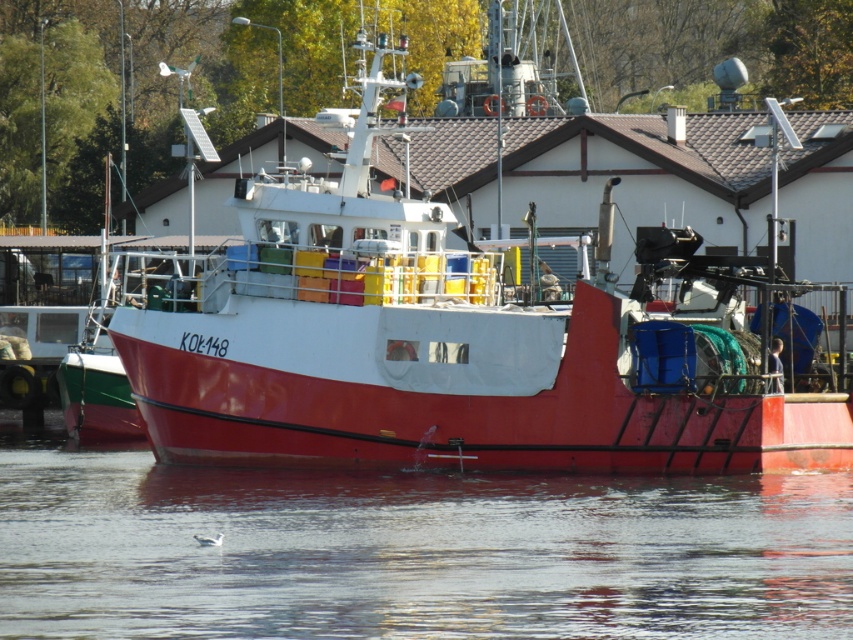
Question: Where is red matte boat at center located in relation to transparent water at lower center in the image?

Choices:
 (A) left
 (B) right

Answer: (B)

Question: In this image, where is red matte boat at center located relative to transparent water at lower center?

Choices:
 (A) above
 (B) below

Answer: (A)

Question: Is red matte boat at center in front of transparent water at lower center?

Choices:
 (A) yes
 (B) no

Answer: (B)

Question: Among these points, which one is farthest from the camera?

Choices:
 (A) pyautogui.click(x=306, y=458)
 (B) pyautogui.click(x=212, y=477)

Answer: (A)